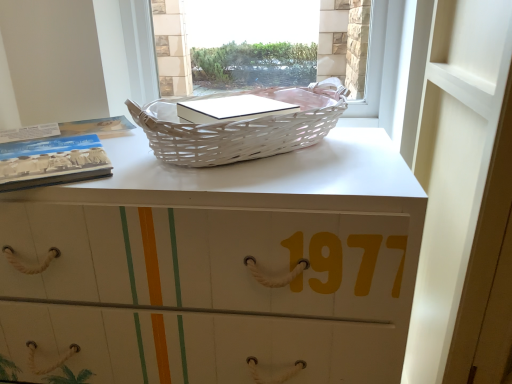
You are a GUI agent. You are given a task and a screenshot of the screen. Output one action in this format:
    pyautogui.click(x=<x>, y=<y>)
    Task: Click on the vacant point to the right of matte paper book at left
    
    Given the screenshot: What is the action you would take?
    pyautogui.click(x=140, y=162)